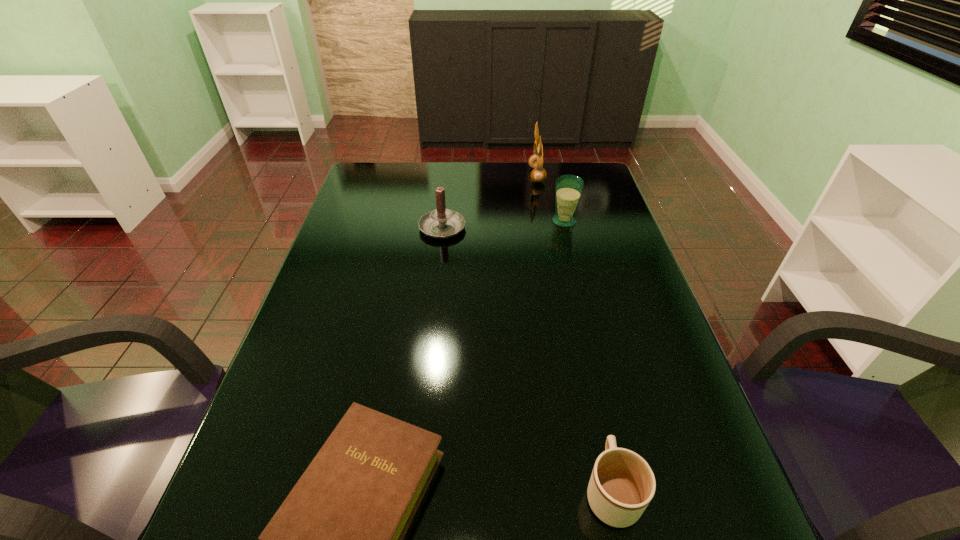
The image size is (960, 540). I want to click on vacant space situated on the side of the candle with the handle loop, so click(448, 176).

Where is `free space located 0.060m on the right of the glass`? The image size is (960, 540). free space located 0.060m on the right of the glass is located at coordinates (597, 221).

Identify the location of vacant space located on the side of the second shortest object with the handle. (571, 302).

Where is `free space located on the side of the second shortest object with the handle`? The width and height of the screenshot is (960, 540). free space located on the side of the second shortest object with the handle is located at coordinates (591, 400).

This screenshot has height=540, width=960. In order to click on vacant space positioned on the side of the second shortest object with the handle in this screenshot , I will do `click(594, 413)`.

In order to click on object that is at the far edge in this screenshot , I will do `click(535, 161)`.

This screenshot has width=960, height=540. In order to click on glass present at the right edge in this screenshot , I will do click(568, 188).

This screenshot has height=540, width=960. Find the location of `mug that is at the right edge`. mug that is at the right edge is located at coordinates (622, 484).

In the image, there is a desktop. Where is `vacant area at the far edge`? The width and height of the screenshot is (960, 540). vacant area at the far edge is located at coordinates (501, 188).

At what (x,y) coordinates should I click in order to perform the action: click on vacant space at the left edge of the desktop. Please return your answer as a coordinate pair (x, y). Looking at the image, I should click on (358, 334).